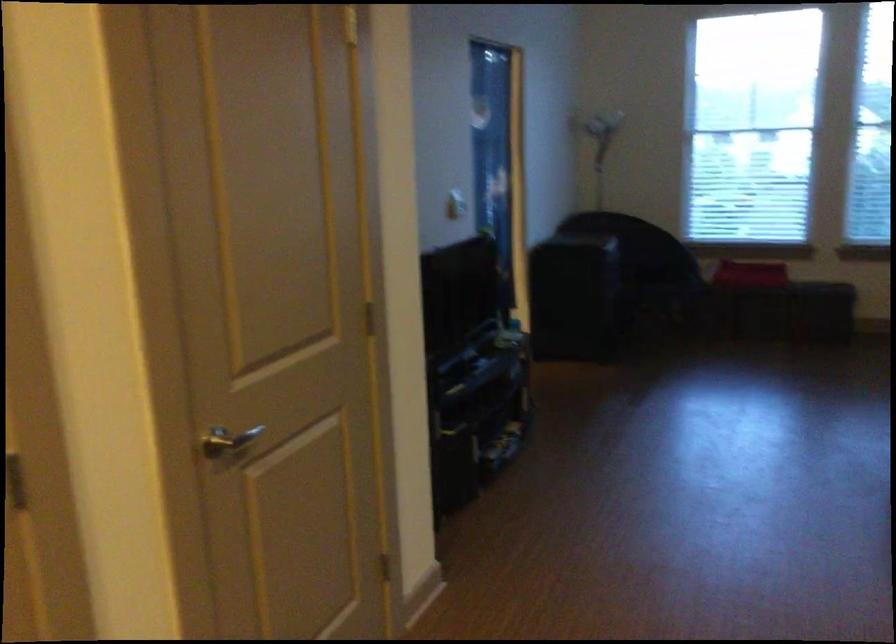
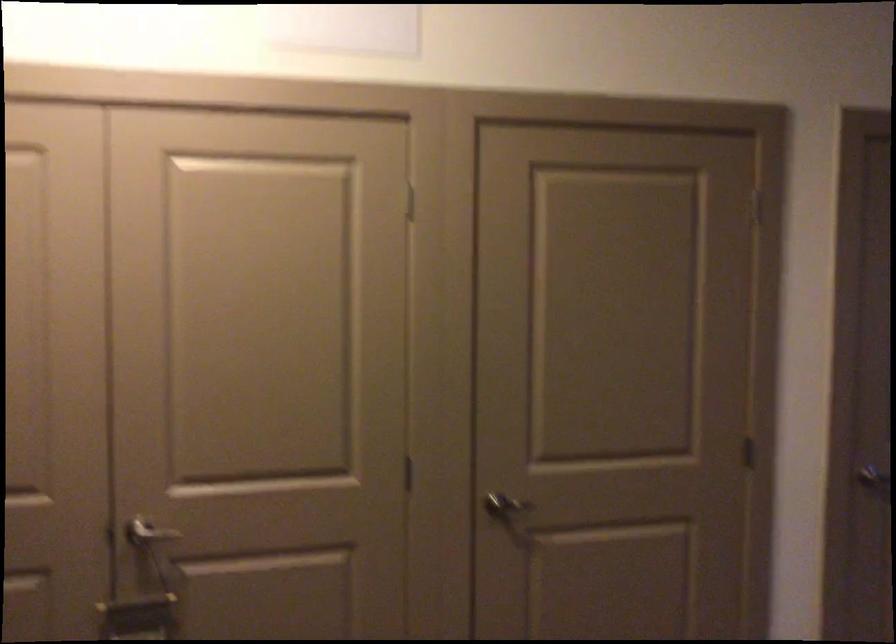
Locate, in the second image, the point that corresponds to pixel 194 456 in the first image.

(853, 476)